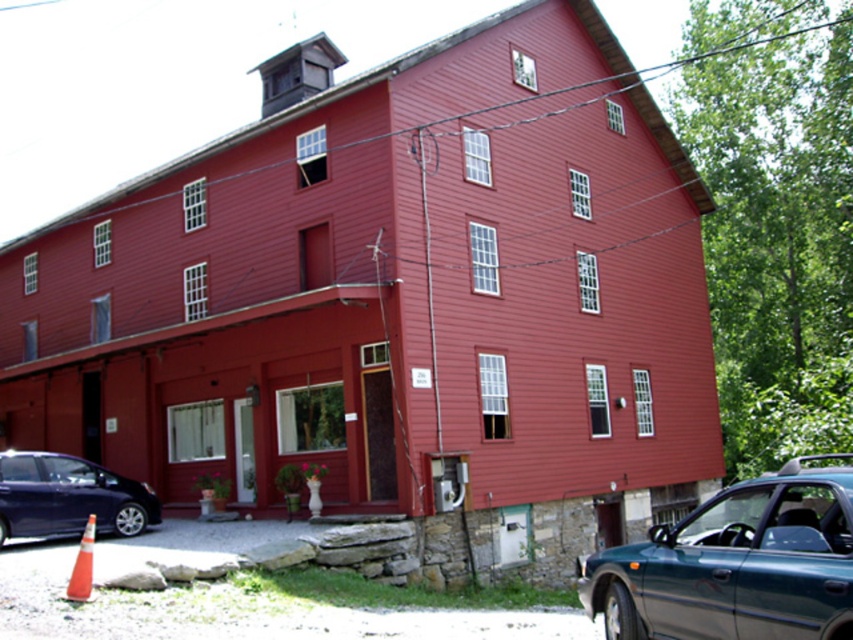
Is point (91, 508) closer to camera compared to point (83, 563)?

No, (91, 508) is behind (83, 563).

Which of these two, metallic blue car at lower left or orange reflective cone at lower left, stands shorter?

orange reflective cone at lower left is shorter.

Which is behind, point (100, 522) or point (76, 564)?

Point (100, 522)

This screenshot has height=640, width=853. I want to click on metallic blue car at lower left, so (68, 497).

Is green matte car at lower right thinner than orange reflective cone at lower left?

Incorrect, green matte car at lower right's width is not less than orange reflective cone at lower left's.

Who is more forward, (x=838, y=598) or (x=91, y=516)?

Point (x=838, y=598) is in front.

Where is `green matte car at lower right`? Image resolution: width=853 pixels, height=640 pixels. green matte car at lower right is located at coordinates (735, 564).

Is green matte car at lower right to the left of metallic blue car at lower left from the viewer's perspective?

Incorrect, green matte car at lower right is not on the left side of metallic blue car at lower left.

Does green matte car at lower right appear on the right side of metallic blue car at lower left?

Yes, green matte car at lower right is to the right of metallic blue car at lower left.

Does point (631, 616) come behind point (125, 509)?

That is False.

Where is `green matte car at lower right`? green matte car at lower right is located at coordinates (735, 564).